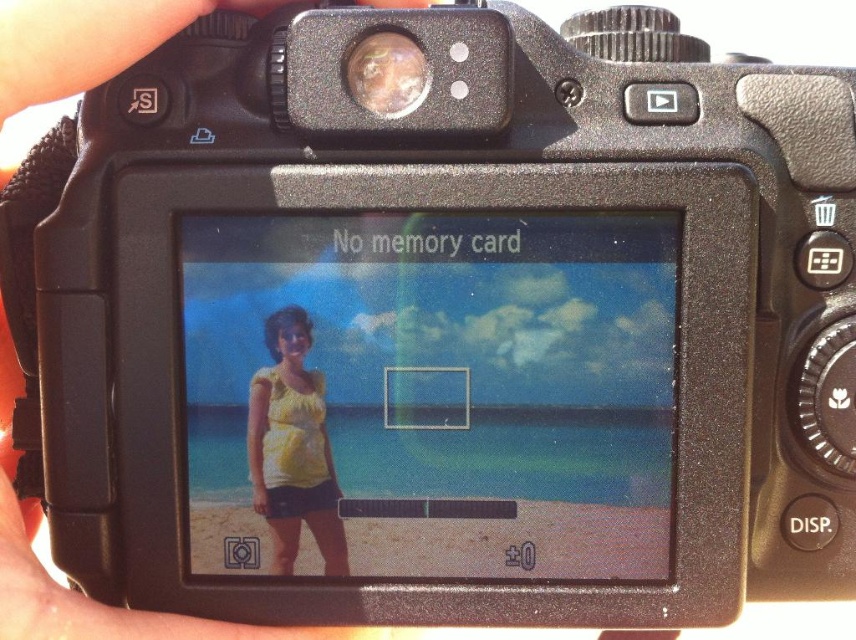
Based on the photo, you are using a DSLR camera to take a photo of a person on a beach. The camera screen shows a point at coordinates (310, 448). If you want to ensure the person is in focus, where should you adjust the focus point to?

The point at (310, 448) is 33.38 inches away from the viewer. To ensure the person is in focus, adjust the focus point to the area where the person is located, which should be at the same distance as the point mentioned.

You are using a DSLR camera to frame a photo of a person on a beach. The camera screen shows the yellow cotton shirt at center. Based on the coordinates provided, is the shirt positioned closer to the left or right side of the screen?

The yellow cotton shirt at center is located at point 0.700 on the x axis, which means it is closer to the right side of the screen.

You are a photographer reviewing the image on the camera screen. You notice the yellow cotton shirt at center and the metallic reflective lens at upper center. Which object is positioned higher on the screen?

The metallic reflective lens at upper center is positioned higher on the screen than the yellow cotton shirt at center.